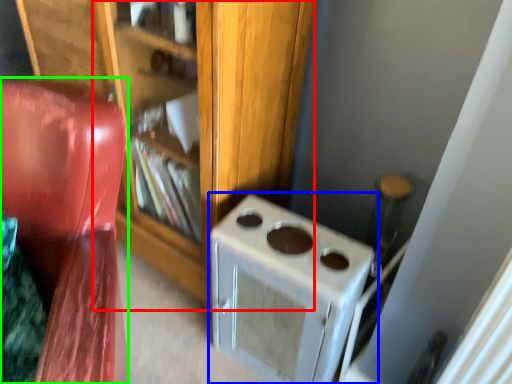
Question: Which object is the closest to the bookshelf (highlighted by a red box)? Choose among these: home appliance (highlighted by a blue box) or furniture (highlighted by a green box).

Choices:
 (A) home appliance
 (B) furniture

Answer: (A)